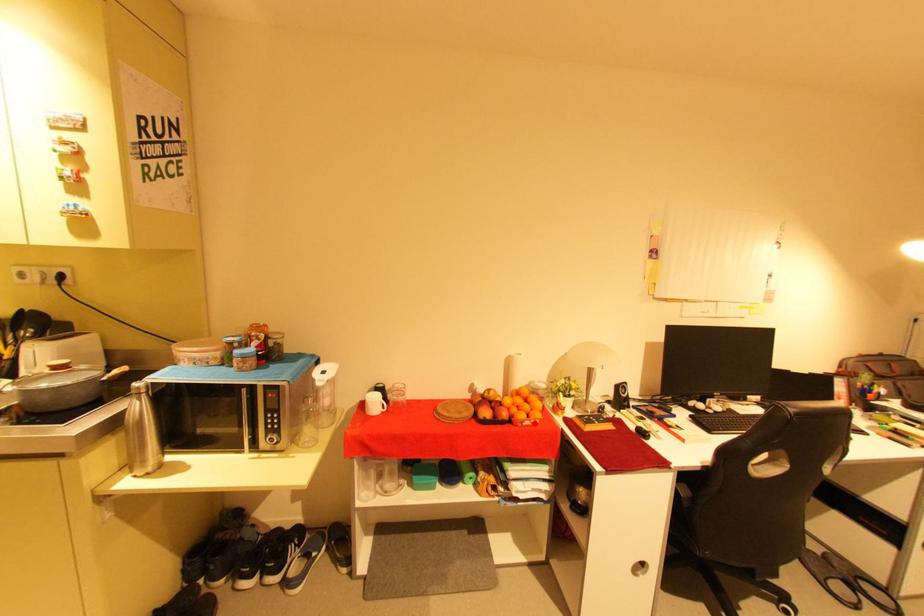
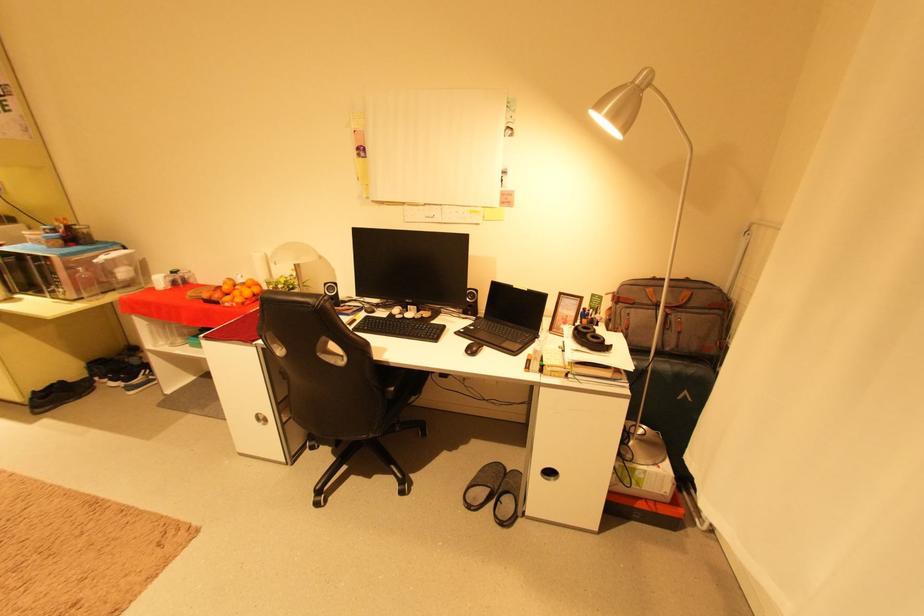
Question: A red point is marked in image1. In image2, is the corresponding 3D point closer to the camera or farther? Reply with the corresponding letter.

Choices:
 (A) The corresponding 3D point is closer.
 (B) The corresponding 3D point is farther.

Answer: (B)